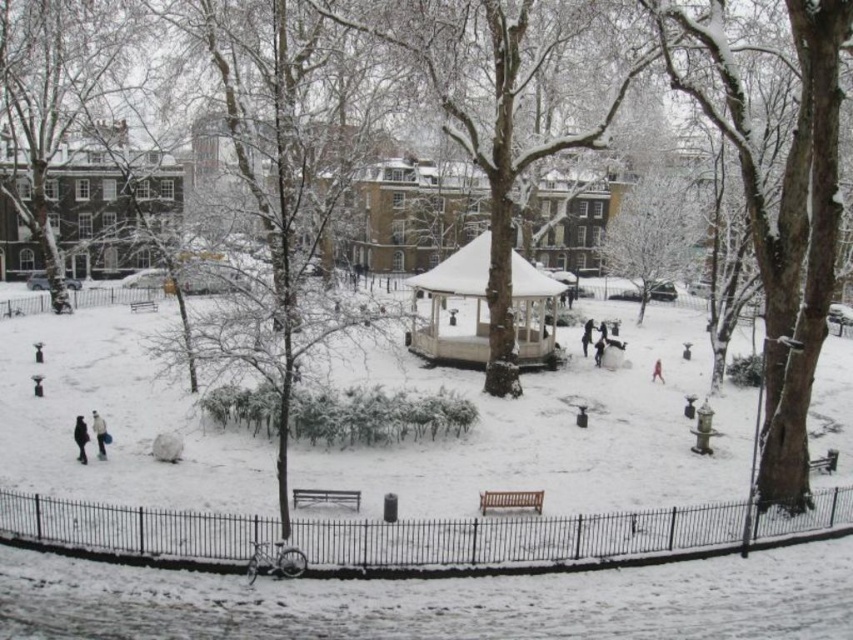
Question: Which object appears farthest from the camera in this image?

Choices:
 (A) snow-covered bark tree at center-right
 (B) white wooden gazebo at center
 (C) red fabric coat at center

Answer: (C)

Question: Observing the image, what is the correct spatial positioning of white wooden gazebo at center in reference to light brown leather jacket at lower left?

Choices:
 (A) right
 (B) left

Answer: (A)

Question: Does white wooden gazebo at center come behind black fabric coat at lower left?

Choices:
 (A) no
 (B) yes

Answer: (B)

Question: Does snow-covered bark tree at center-right appear on the left side of black fabric coat at lower left?

Choices:
 (A) yes
 (B) no

Answer: (B)

Question: Which point is closer to the camera taking this photo?

Choices:
 (A) 657,364
 (B) 91,412
 (C) 74,438
 (D) 657,22

Answer: (D)

Question: Based on their relative distances, which object is nearer to the light brown leather jacket at lower left?

Choices:
 (A) white wooden gazebo at center
 (B) white fluffy snow at center
 (C) red fabric coat at center

Answer: (B)